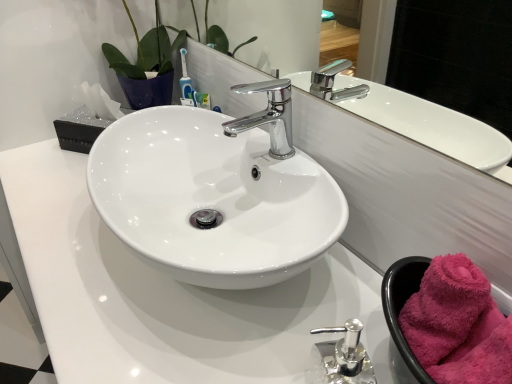
Question: Is glossy ceramic mirror at upper center positioned beyond the bounds of chrome/metallic faucet at center?

Choices:
 (A) no
 (B) yes

Answer: (B)

Question: Is glossy ceramic mirror at upper center behind chrome/metallic faucet at center?

Choices:
 (A) no
 (B) yes

Answer: (A)

Question: From the image's perspective, would you say glossy ceramic mirror at upper center is shown under chrome/metallic faucet at center?

Choices:
 (A) yes
 (B) no

Answer: (B)

Question: Can you confirm if glossy ceramic mirror at upper center is wider than chrome/metallic faucet at center?

Choices:
 (A) no
 (B) yes

Answer: (A)

Question: Considering the relative sizes of glossy ceramic mirror at upper center and chrome/metallic faucet at center in the image provided, is glossy ceramic mirror at upper center thinner than chrome/metallic faucet at center?

Choices:
 (A) yes
 (B) no

Answer: (A)

Question: Can you confirm if glossy ceramic mirror at upper center is shorter than chrome/metallic faucet at center?

Choices:
 (A) yes
 (B) no

Answer: (B)

Question: Is pink fluffy bath towel at lower right at the back of chrome/metallic faucet at center?

Choices:
 (A) yes
 (B) no

Answer: (B)

Question: Is chrome/metallic faucet at center next to pink fluffy bath towel at lower right and touching it?

Choices:
 (A) yes
 (B) no

Answer: (B)

Question: Does chrome/metallic faucet at center come in front of pink fluffy bath towel at lower right?

Choices:
 (A) no
 (B) yes

Answer: (A)

Question: Can you confirm if chrome/metallic faucet at center is positioned to the right of pink fluffy bath towel at lower right?

Choices:
 (A) no
 (B) yes

Answer: (A)

Question: Can you confirm if chrome/metallic faucet at center is taller than pink fluffy bath towel at lower right?

Choices:
 (A) yes
 (B) no

Answer: (A)

Question: Does chrome/metallic faucet at center have a lesser height compared to pink fluffy bath towel at lower right?

Choices:
 (A) no
 (B) yes

Answer: (A)

Question: Can you confirm if white glossy counter top at center is thinner than chrome/metallic faucet at center?

Choices:
 (A) yes
 (B) no

Answer: (B)